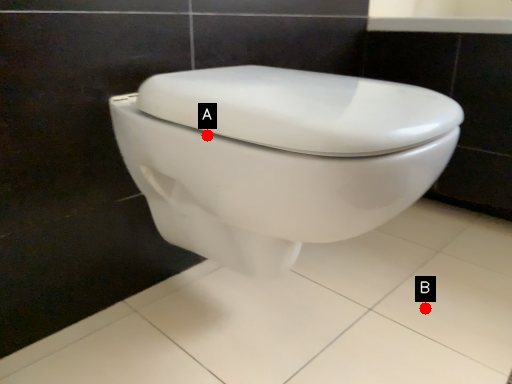
Question: Two points are circled on the image, labeled by A and B beside each circle. Among these points, which one is farthest from the camera?

Choices:
 (A) A is further
 (B) B is further

Answer: (B)